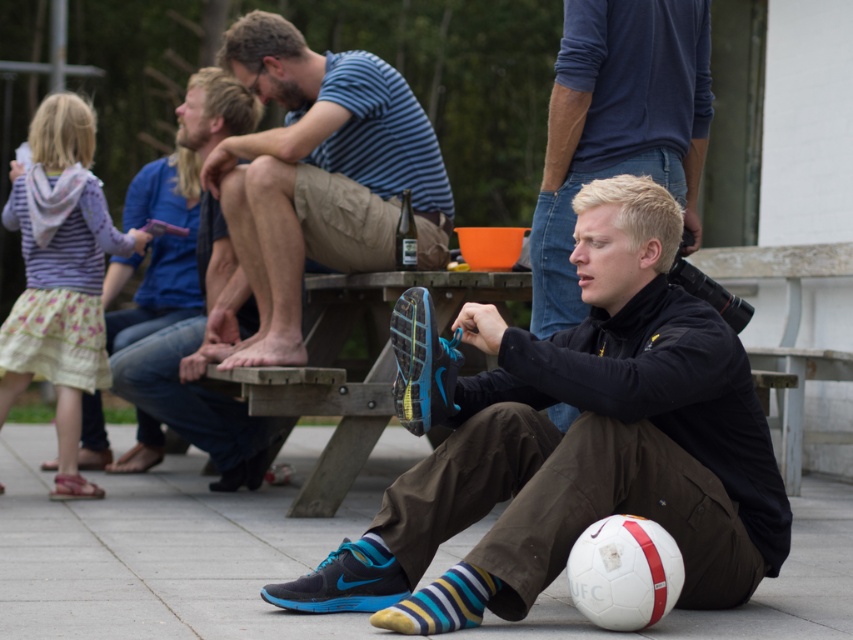
Which of these two, matte black jacket at center or black matte jacket at center, stands shorter?

With less height is black matte jacket at center.

Who is more distant from viewer, (x=729, y=490) or (x=541, y=220)?

Positioned behind is point (x=541, y=220).

Where is `matte black jacket at center`? matte black jacket at center is located at coordinates (576, 444).

Is matte black jacket at center positioned at the back of striped cotton shirt at upper center?

No, it is in front of striped cotton shirt at upper center.

Based on the photo, who is positioned more to the left, matte black jacket at center or striped cotton shirt at upper center?

From the viewer's perspective, striped cotton shirt at upper center appears more on the left side.

What do you see at coordinates (576, 444) in the screenshot? I see `matte black jacket at center` at bounding box center [576, 444].

This screenshot has height=640, width=853. What are the coordinates of `matte black jacket at center` in the screenshot? It's located at (576, 444).

Is striped cotton shirt at upper center below black matte jacket at center?

Incorrect, striped cotton shirt at upper center is not positioned below black matte jacket at center.

Is striped cotton shirt at upper center taller than black matte jacket at center?

Indeed, striped cotton shirt at upper center has a greater height compared to black matte jacket at center.

Is point (393, 154) positioned in front of point (566, 237)?

No, (393, 154) is further to viewer.

Locate an element on the screen. striped cotton shirt at upper center is located at coordinates (320, 173).